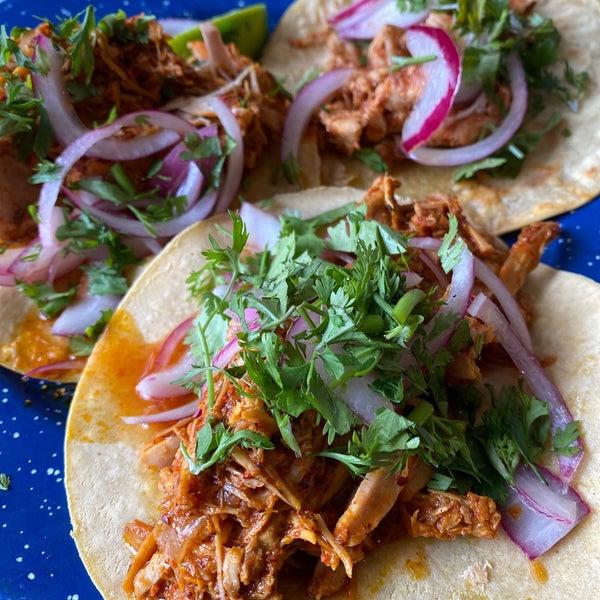
Find the location of a particular element. The height and width of the screenshot is (600, 600). dark blue tablecloth is located at coordinates (26, 498).